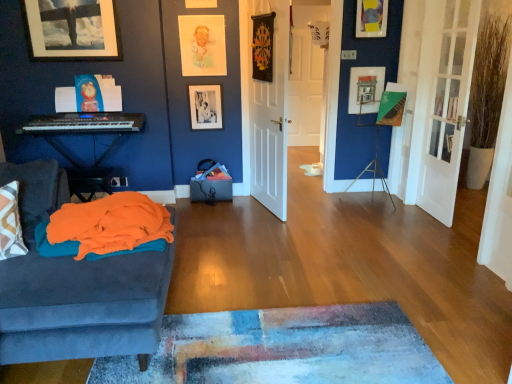
Locate an element on the screen. The height and width of the screenshot is (384, 512). vacant space behind textured wool rug at lower center is located at coordinates (294, 269).